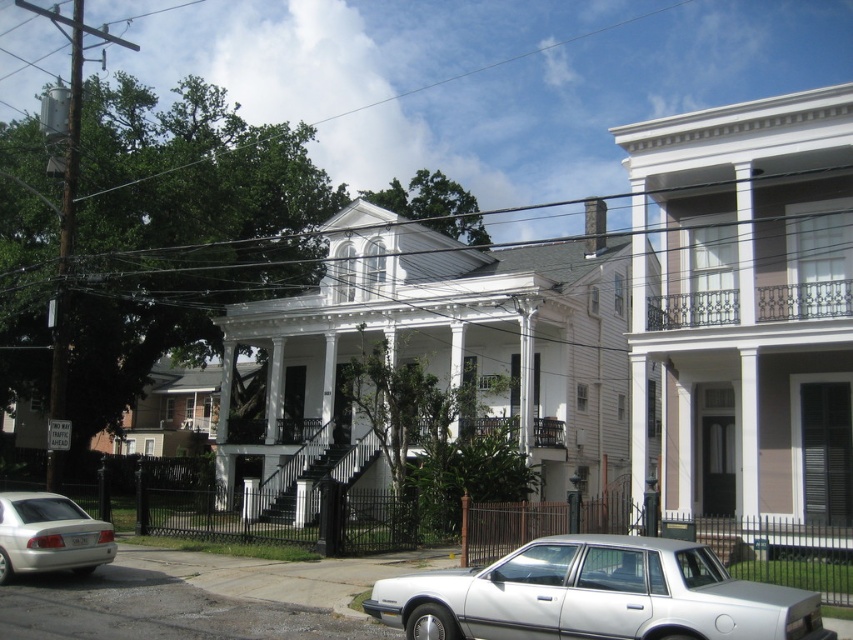
Question: Does white matte sedan at lower center have a smaller size compared to silver metallic sedan at lower left?

Choices:
 (A) no
 (B) yes

Answer: (A)

Question: Can you confirm if white matte sedan at lower center is wider than silver metallic sedan at lower left?

Choices:
 (A) no
 (B) yes

Answer: (B)

Question: Which point is closer to the camera?

Choices:
 (A) silver metallic sedan at lower left
 (B) white matte sedan at lower center

Answer: (B)

Question: Is white matte sedan at lower center above silver metallic sedan at lower left?

Choices:
 (A) yes
 (B) no

Answer: (A)